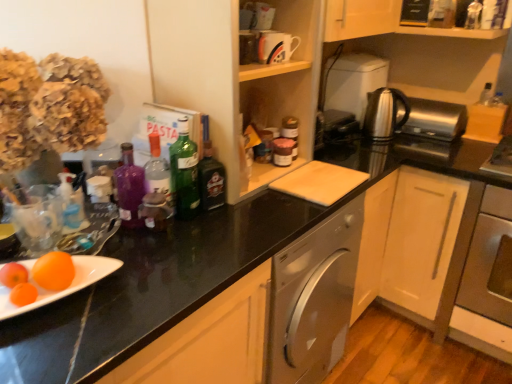
The width and height of the screenshot is (512, 384). Find the location of `space that is in front of silver metallic kettle at right`. space that is in front of silver metallic kettle at right is located at coordinates (392, 147).